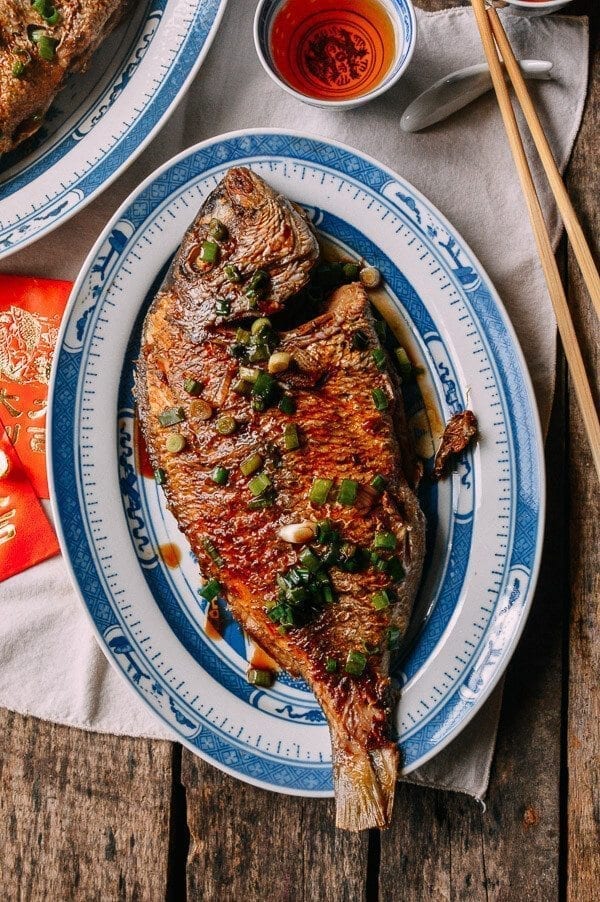
Locate an element on the screen. The height and width of the screenshot is (902, 600). chopsticks is located at coordinates (517, 154), (534, 118).